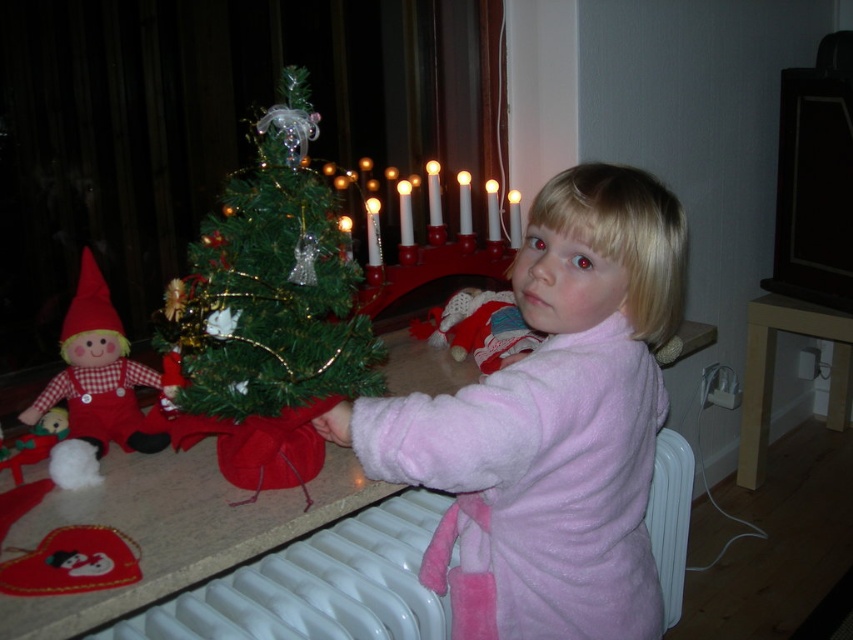
Question: Which point is closer to the camera?

Choices:
 (A) (28, 412)
 (B) (514, 570)

Answer: (B)

Question: From the image, what is the correct spatial relationship of white glossy candle holder at center in relation to velvet plush santa at center?

Choices:
 (A) left
 (B) right

Answer: (A)

Question: Does pink fuzzy pajamas at center have a greater width compared to red plaid fabric doll at left?

Choices:
 (A) yes
 (B) no

Answer: (A)

Question: Considering the real-world distances, which object is closest to the pink fuzzy pajamas at center?

Choices:
 (A) velvet plush santa at center
 (B) white plastic radiator at lower center
 (C) red plaid fabric doll at left

Answer: (B)

Question: Is green matte christmas tree at center thinner than white plastic radiator at lower center?

Choices:
 (A) yes
 (B) no

Answer: (A)

Question: Which is nearer to the green matte christmas tree at center?

Choices:
 (A) pink fuzzy pajamas at center
 (B) white plastic radiator at lower center
 (C) velvet plush santa at center

Answer: (A)